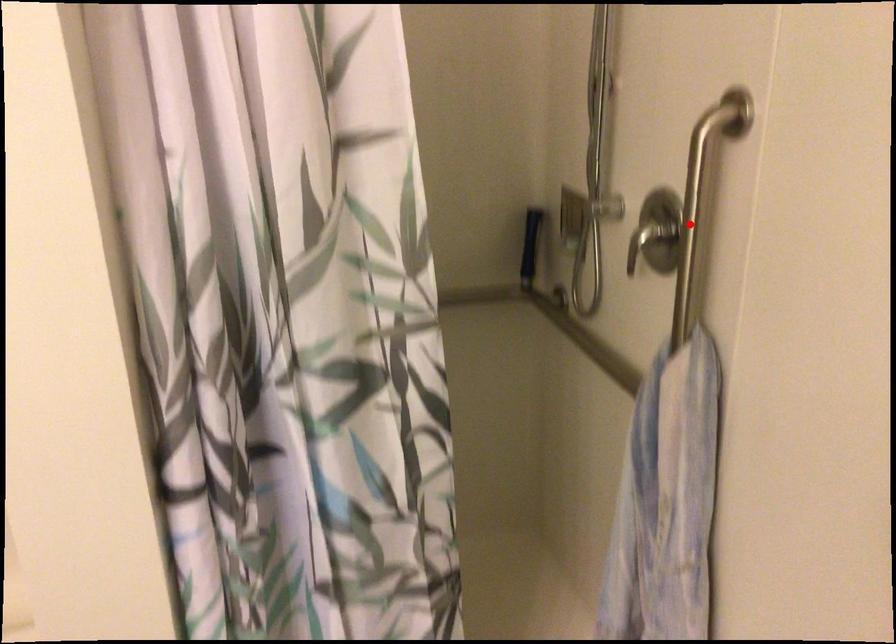
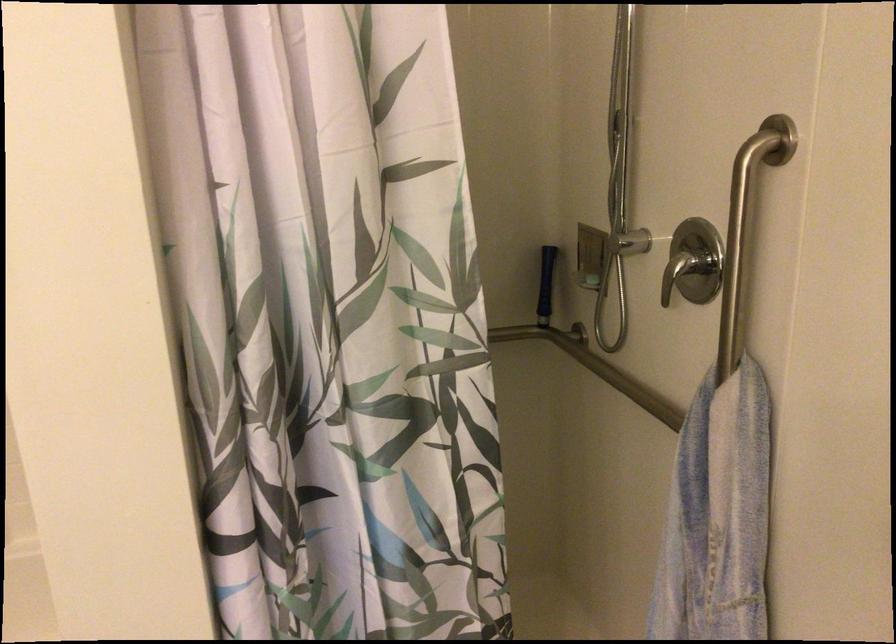
Locate, in the second image, the point that corresponds to the highlighted location in the first image.

(737, 245)